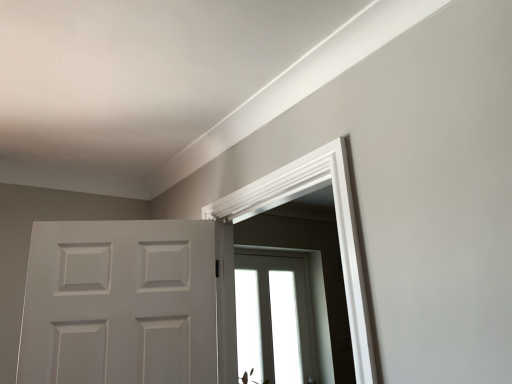
Question: Is transparent glass window at center at the back of white smooth door frame at upper center?

Choices:
 (A) yes
 (B) no

Answer: (B)

Question: From the image's perspective, is white smooth door frame at upper center on transparent glass window at center?

Choices:
 (A) no
 (B) yes

Answer: (B)

Question: Does white smooth door frame at upper center have a greater width compared to transparent glass window at center?

Choices:
 (A) no
 (B) yes

Answer: (B)

Question: Is white smooth door frame at upper center taller than transparent glass window at center?

Choices:
 (A) no
 (B) yes

Answer: (A)

Question: From a real-world perspective, is white smooth door frame at upper center under transparent glass window at center?

Choices:
 (A) yes
 (B) no

Answer: (B)

Question: Is white smooth door frame at upper center to the right of transparent glass window at center from the viewer's perspective?

Choices:
 (A) no
 (B) yes

Answer: (A)

Question: Is transparent glass window at center with white smooth door frame at upper center?

Choices:
 (A) yes
 (B) no

Answer: (B)

Question: Is transparent glass window at center positioned in front of white smooth door frame at upper center?

Choices:
 (A) no
 (B) yes

Answer: (A)

Question: Considering the relative sizes of transparent glass window at center and white smooth door frame at upper center in the image provided, is transparent glass window at center smaller than white smooth door frame at upper center?

Choices:
 (A) no
 (B) yes

Answer: (B)

Question: Considering the relative sizes of transparent glass window at center and white smooth door frame at upper center in the image provided, is transparent glass window at center thinner than white smooth door frame at upper center?

Choices:
 (A) yes
 (B) no

Answer: (A)

Question: Does transparent glass window at center have a larger size compared to white smooth door frame at upper center?

Choices:
 (A) no
 (B) yes

Answer: (A)

Question: Is transparent glass window at center positioned beyond the bounds of white smooth door frame at upper center?

Choices:
 (A) yes
 (B) no

Answer: (A)

Question: From the image's perspective, is white matte door at center below transparent glass window at center?

Choices:
 (A) yes
 (B) no

Answer: (B)